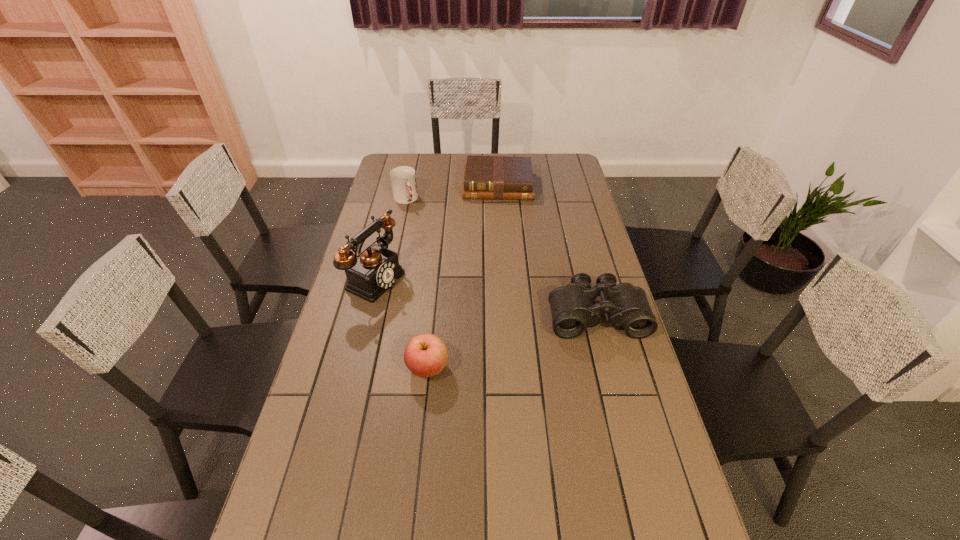
Where is `the nearest object`? The height and width of the screenshot is (540, 960). the nearest object is located at coordinates (425, 355).

Locate an element on the screen. The height and width of the screenshot is (540, 960). the third object from right to left is located at coordinates (425, 355).

This screenshot has width=960, height=540. Find the location of `binoculars`. binoculars is located at coordinates (573, 308).

This screenshot has height=540, width=960. In order to click on the shortest object in this screenshot , I will do `click(485, 177)`.

This screenshot has width=960, height=540. Identify the location of cup. (403, 178).

This screenshot has width=960, height=540. In order to click on telephone in this screenshot , I will do `click(376, 269)`.

Identify the location of free space located 0.150m on the right of the third object from left to right. This screenshot has width=960, height=540. (502, 368).

In order to click on vacant region located at the eyepieces of the binoculars in this screenshot , I will do `click(612, 373)`.

Where is `vacant space located on the spine side of the Bible`? The height and width of the screenshot is (540, 960). vacant space located on the spine side of the Bible is located at coordinates pyautogui.click(x=498, y=212).

The width and height of the screenshot is (960, 540). In order to click on free space located 0.080m on the spine side of the Bible in this screenshot , I will do `click(498, 212)`.